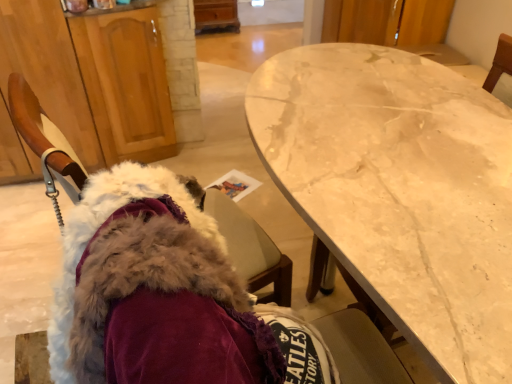
Question: Choose the correct answer: Is white marble table at center inside wooden cabinet at left or outside it?

Choices:
 (A) outside
 (B) inside

Answer: (A)

Question: From their relative heights in the image, would you say white marble table at center is taller or shorter than wooden cabinet at left?

Choices:
 (A) short
 (B) tall

Answer: (B)

Question: Estimate the real-world distances between objects in this image. Which object is farther from the fuzzy fabric chair at left?

Choices:
 (A) wooden cabinet at left
 (B) white marble table at center

Answer: (A)

Question: Estimate the real-world distances between objects in this image. Which object is farther from the wooden cabinet at left?

Choices:
 (A) fuzzy fabric chair at left
 (B) white marble table at center

Answer: (B)